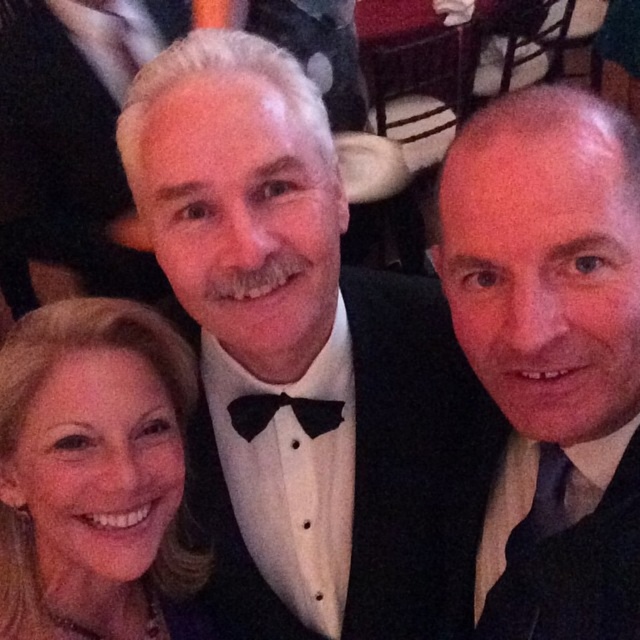
Question: Which of the following is the farthest from the observer?

Choices:
 (A) (339, 406)
 (B) (120, 563)
 (C) (353, 422)
 (D) (620, 198)

Answer: (C)

Question: Which object is positioned farthest from the black satin tuxedo at center?

Choices:
 (A) black satin suit at center
 (B) black satin bow tie at center
 (C) blonde hair at lower left

Answer: (A)

Question: Does black satin tuxedo at center have a smaller size compared to black satin bow tie at center?

Choices:
 (A) no
 (B) yes

Answer: (A)

Question: Which of the following is the closest to the observer?

Choices:
 (A) black satin bow tie at center
 (B) black satin suit at center

Answer: (B)

Question: Does black satin tuxedo at center lie in front of blonde hair at lower left?

Choices:
 (A) no
 (B) yes

Answer: (B)

Question: Is black satin tuxedo at center to the right of black satin bow tie at center from the viewer's perspective?

Choices:
 (A) no
 (B) yes

Answer: (B)